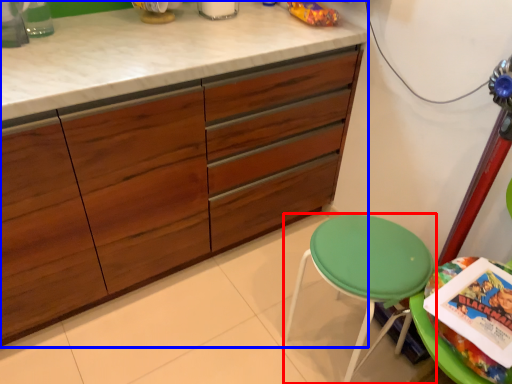
Question: Which object is closer to the camera taking this photo, stool (highlighted by a red box) or cabinetry (highlighted by a blue box)?

Choices:
 (A) stool
 (B) cabinetry

Answer: (B)